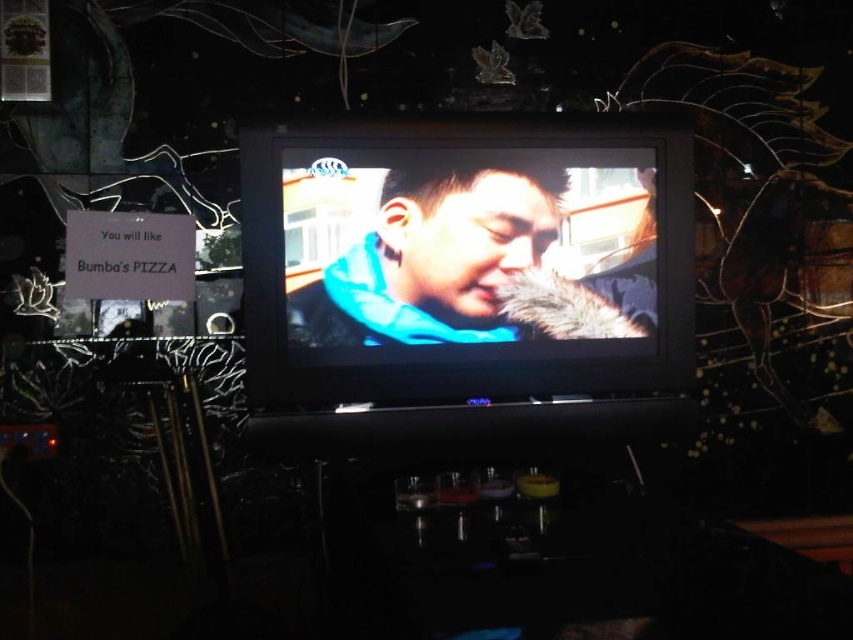
Question: Which object appears closest to the camera in this image?

Choices:
 (A) blue matte scarf at center
 (B) matte black tv at center

Answer: (B)

Question: Which point is closer to the camera?

Choices:
 (A) (257, 380)
 (B) (466, 205)

Answer: (A)

Question: Among these points, which one is nearest to the camera?

Choices:
 (A) (537, 228)
 (B) (418, 122)

Answer: (B)

Question: Does matte black tv at center come behind blue matte scarf at center?

Choices:
 (A) no
 (B) yes

Answer: (A)

Question: Does matte black tv at center appear on the left side of blue matte scarf at center?

Choices:
 (A) no
 (B) yes

Answer: (A)

Question: Is matte black tv at center thinner than blue matte scarf at center?

Choices:
 (A) yes
 (B) no

Answer: (B)